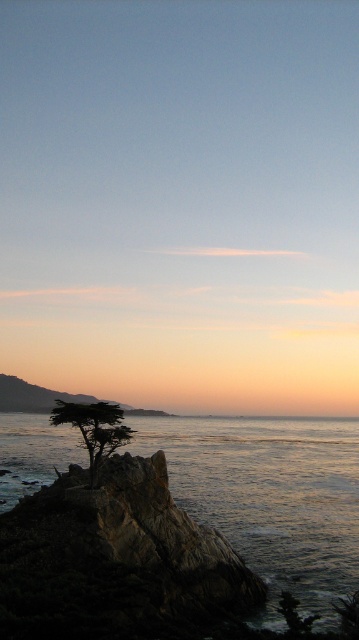
You are a photographer positioned at the shoreline looking towards the horizon. You notice the shiny silver water at center and the green matte tree at center. Which object is closer to you?

The shiny silver water at center is closer to you because it is in front of the green matte tree at center.

You are a photographer wanting to capture the green matte tree at center and the shiny silver water at center in the same frame. Based on their positions, which object should you adjust your camera to focus on first if you want to include both in your shot?

The shiny silver water at center is to the right of green matte tree at center, so you should focus on the green matte tree at center first to ensure both are in the frame.